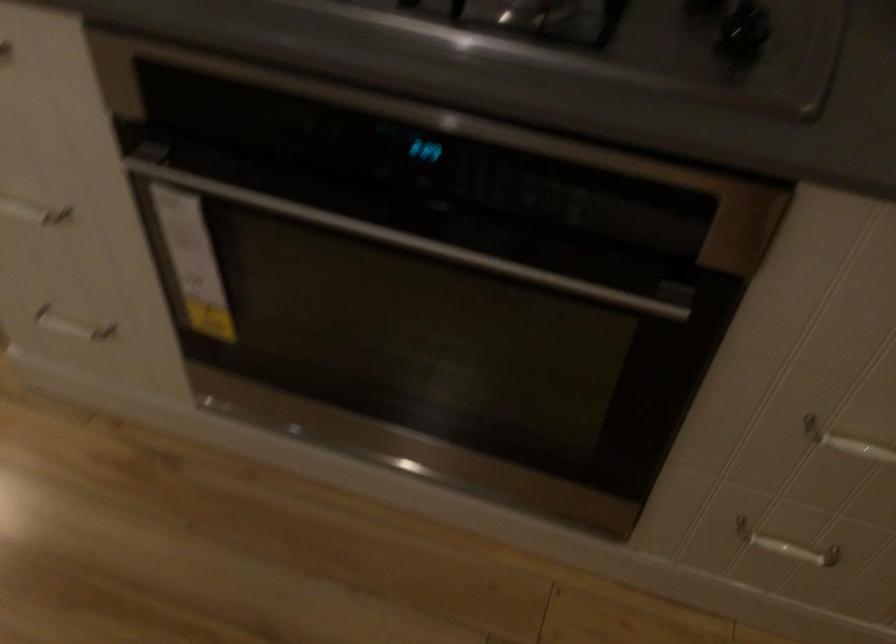
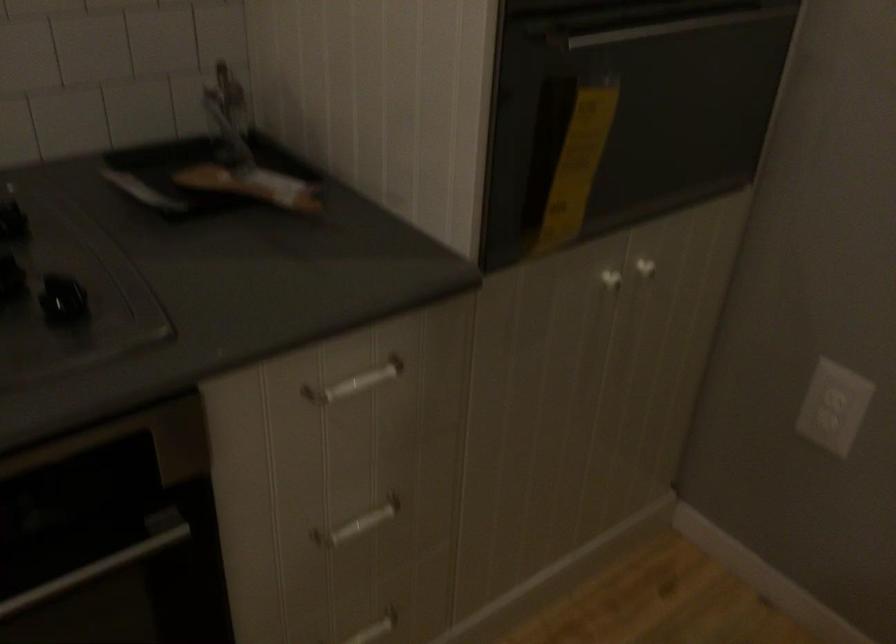
In the second image, find the point that corresponds to [804,547] in the first image.

(374, 629)